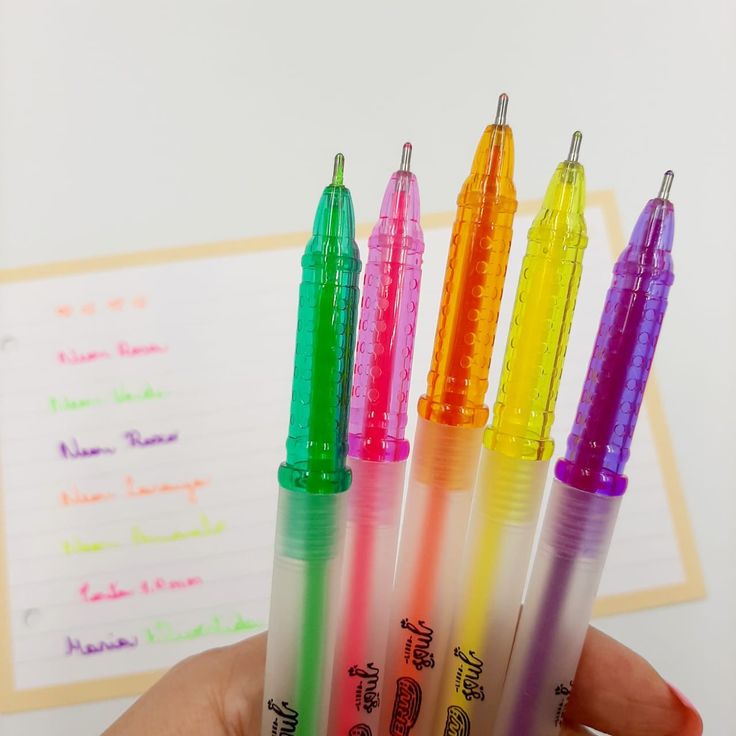
Where is `pens`? pens is located at coordinates (330, 411), (364, 392), (466, 364), (547, 381), (597, 392).